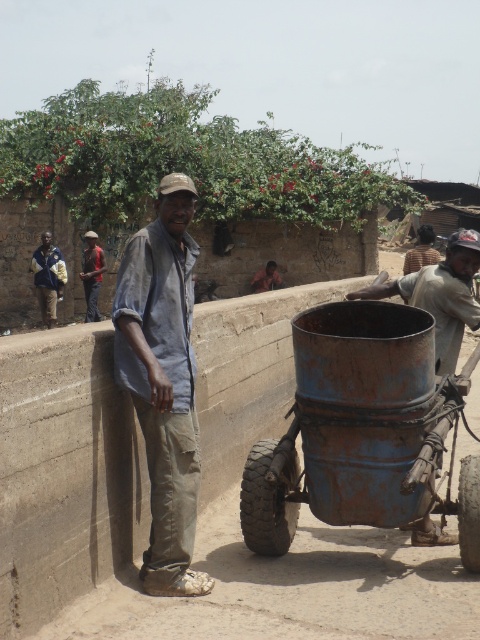
Can you confirm if denim shirt at center is positioned above brown leather jacket at center?

Incorrect, denim shirt at center is not positioned above brown leather jacket at center.

What are the coordinates of `denim shirt at center` in the screenshot? It's located at (164, 381).

Where is `denim shirt at center`? This screenshot has width=480, height=640. denim shirt at center is located at coordinates (164, 381).

Who is more forward, (357, 442) or (257, 272)?

Point (357, 442) is in front.

Is rusty metal wagon at center closer to camera compared to brown leather jacket at center?

Yes, rusty metal wagon at center is in front of brown leather jacket at center.

What do you see at coordinates (361, 429) in the screenshot? I see `rusty metal wagon at center` at bounding box center [361, 429].

Find the location of a particular element. rusty metal wagon at center is located at coordinates (361, 429).

Which is behind, point (470, 326) or point (47, 317)?

Positioned behind is point (47, 317).

Where is `rusty metal bucket at right`? rusty metal bucket at right is located at coordinates (441, 296).